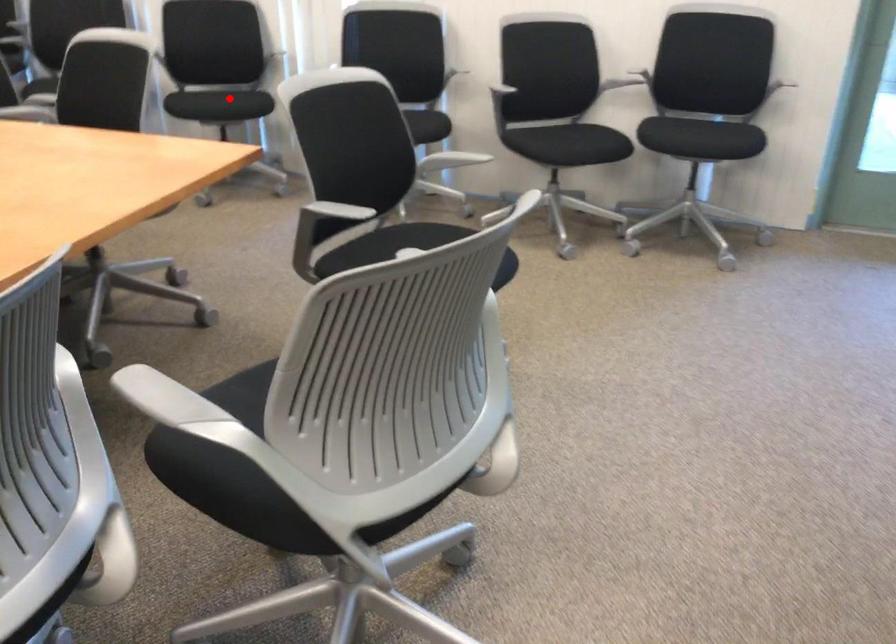
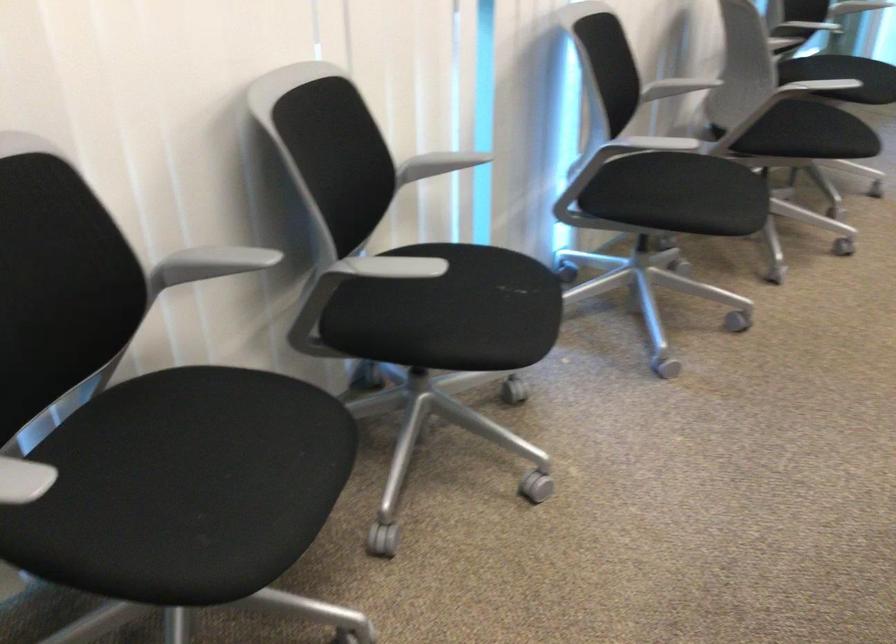
Find the pixel in the second image that matches the highlighted location in the first image.

(515, 287)